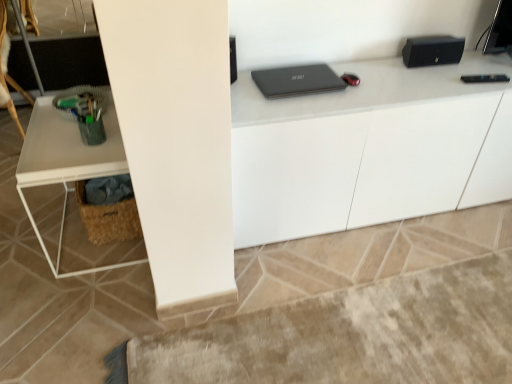
Question: Is wooden swivel chair at left not near woven brown basket at lower left?

Choices:
 (A) no
 (B) yes

Answer: (B)

Question: Is wooden swivel chair at left closer to the viewer compared to woven brown basket at lower left?

Choices:
 (A) yes
 (B) no

Answer: (B)

Question: Does wooden swivel chair at left have a lesser height compared to woven brown basket at lower left?

Choices:
 (A) no
 (B) yes

Answer: (A)

Question: Is woven brown basket at lower left at the back of wooden swivel chair at left?

Choices:
 (A) no
 (B) yes

Answer: (A)

Question: Does wooden swivel chair at left turn towards woven brown basket at lower left?

Choices:
 (A) yes
 (B) no

Answer: (B)

Question: From a real-world perspective, is matte black laptop at center above or below white matte table at left, which is the 1th computer desk from left to right?

Choices:
 (A) above
 (B) below

Answer: (A)

Question: In the image, is matte black laptop at center positioned in front of or behind white matte table at left, the second computer desk when ordered from right to left?

Choices:
 (A) behind
 (B) front

Answer: (A)

Question: Is matte black laptop at center to the left or to the right of white matte table at left, which is the 1th computer desk from left to right, in the image?

Choices:
 (A) right
 (B) left

Answer: (A)

Question: Is matte black laptop at center wider or thinner than white matte table at left, which is the 1th computer desk from left to right?

Choices:
 (A) wide
 (B) thin

Answer: (B)

Question: Is white matte table at left, which is the 1th computer desk from left to right, in front of or behind matte black laptop at center in the image?

Choices:
 (A) front
 (B) behind

Answer: (A)

Question: From a real-world perspective, is white matte table at left, the second computer desk when ordered from right to left, physically located above or below matte black laptop at center?

Choices:
 (A) below
 (B) above

Answer: (A)

Question: Is point (100, 248) positioned closer to the camera than point (254, 82)?

Choices:
 (A) closer
 (B) farther

Answer: (B)

Question: From the image's perspective, is white matte table at left, the second computer desk when ordered from right to left, located above or below matte black laptop at center?

Choices:
 (A) above
 (B) below

Answer: (B)

Question: Considering the positions of point (104, 211) and point (2, 82), is point (104, 211) closer or farther from the camera than point (2, 82)?

Choices:
 (A) farther
 (B) closer

Answer: (B)

Question: From their relative heights in the image, would you say woven brown basket at lower left is taller or shorter than wooden swivel chair at left?

Choices:
 (A) tall
 (B) short

Answer: (B)